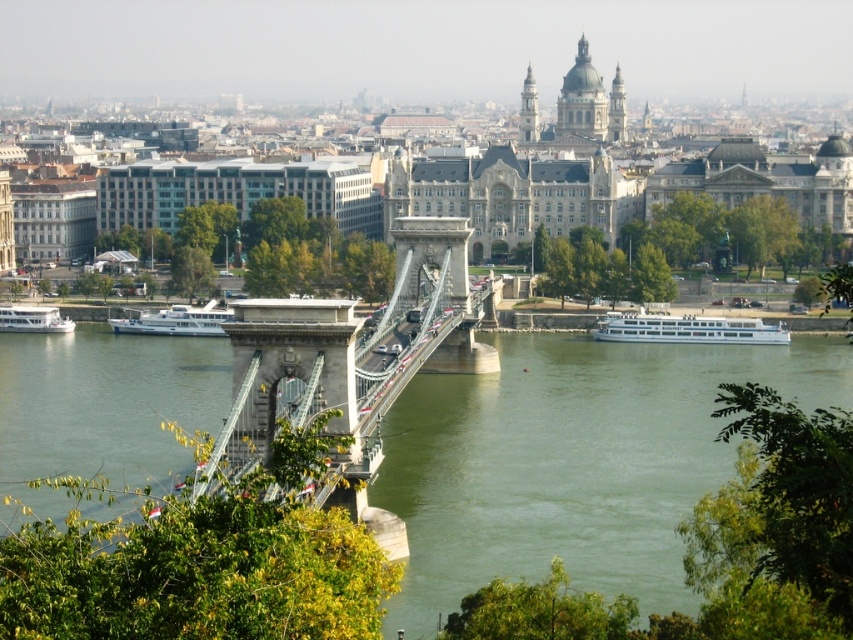
You are a photographer standing at the base of the Szchenyi Chain Bridge in Budapest, Hungary. You want to take a photo that includes both the point at coordinate point(492, 490) and point(752, 336). Which point will appear larger in your photo?

Point(492, 490) will appear larger in the photo because it is closer to the camera than point(752, 336).